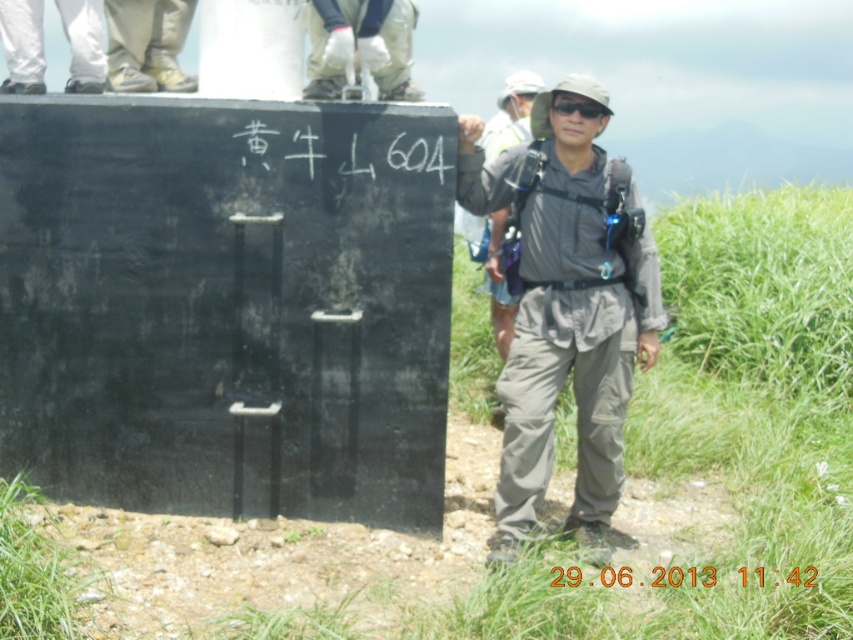
Question: Which point is farther from the camera taking this photo?

Choices:
 (A) (554, 109)
 (B) (138, 77)
 (C) (556, 584)
 (D) (569, 284)

Answer: (B)

Question: Does light beige canvas shoes at upper left have a greater width compared to black matte goggles at center?

Choices:
 (A) no
 (B) yes

Answer: (B)

Question: Estimate the real-world distances between objects in this image. Which object is closer to the light beige canvas shoes at upper left?

Choices:
 (A) black matte goggles at center
 (B) black matte text at center

Answer: (A)

Question: Is light beige canvas shoes at upper left to the right of black matte goggles at center from the viewer's perspective?

Choices:
 (A) no
 (B) yes

Answer: (A)

Question: Which of the following is the closest to the observer?

Choices:
 (A) (654, 586)
 (B) (543, 448)

Answer: (A)

Question: Is gray fabric jacket at center to the left of light beige canvas shoes at upper left from the viewer's perspective?

Choices:
 (A) yes
 (B) no

Answer: (B)